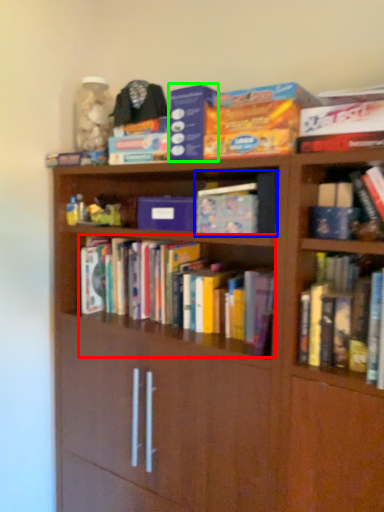
Question: Considering the real-world distances, which object is closest to book (highlighted by a red box)? book (highlighted by a blue box) or paperback book (highlighted by a green box).

Choices:
 (A) book
 (B) paperback book

Answer: (A)